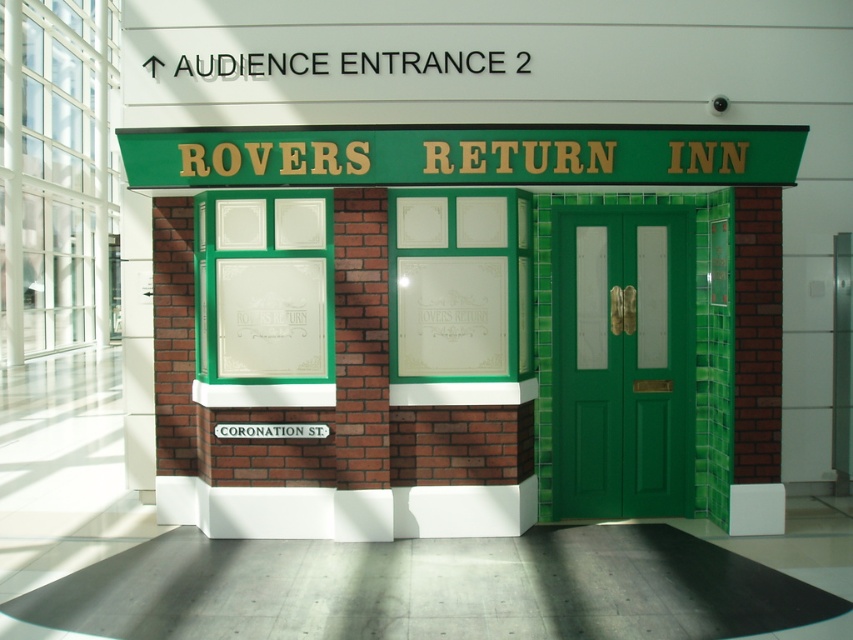
Is green brick storefront at center wider than green wooden door at center?

Correct, the width of green brick storefront at center exceeds that of green wooden door at center.

Which is more to the right, green brick storefront at center or green wooden door at center?

Positioned to the right is green wooden door at center.

Who is more forward, (450, 164) or (619, 420)?

Positioned in front is point (450, 164).

Where is `green brick storefront at center`? The height and width of the screenshot is (640, 853). green brick storefront at center is located at coordinates (405, 316).

Is green wooden door at center to the right of black plastic sign at upper center from the viewer's perspective?

Indeed, green wooden door at center is positioned on the right side of black plastic sign at upper center.

Where is `green wooden door at center`? The width and height of the screenshot is (853, 640). green wooden door at center is located at coordinates (622, 360).

Which of these two, green brick storefront at center or black plastic sign at upper center, stands shorter?

With less height is black plastic sign at upper center.

The width and height of the screenshot is (853, 640). Describe the element at coordinates (405, 316) in the screenshot. I see `green brick storefront at center` at that location.

This screenshot has height=640, width=853. Describe the element at coordinates (405, 316) in the screenshot. I see `green brick storefront at center` at that location.

The image size is (853, 640). Find the location of `green brick storefront at center`. green brick storefront at center is located at coordinates (405, 316).